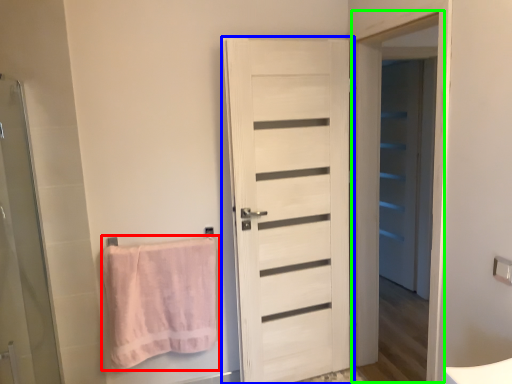
Question: Considering the real-world distances, which object is farthest from towel (highlighted by a red box)? door (highlighted by a blue box) or screen door (highlighted by a green box)?

Choices:
 (A) door
 (B) screen door

Answer: (B)